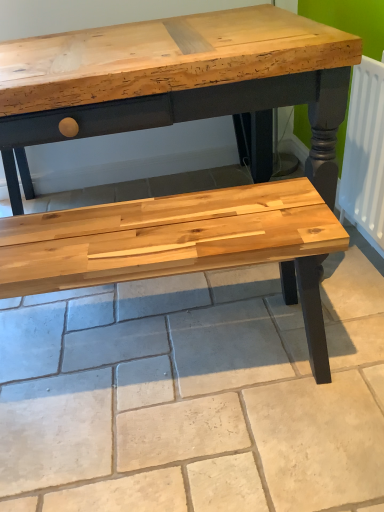
Question: Is natural wood bench at center next to white matte radiator at right and touching it?

Choices:
 (A) no
 (B) yes

Answer: (A)

Question: Is white matte radiator at right surrounded by natural wood bench at center?

Choices:
 (A) no
 (B) yes

Answer: (A)

Question: From a real-world perspective, is natural wood bench at center located higher than white matte radiator at right?

Choices:
 (A) yes
 (B) no

Answer: (B)

Question: Does natural wood bench at center have a smaller size compared to white matte radiator at right?

Choices:
 (A) no
 (B) yes

Answer: (A)

Question: From a real-world perspective, is natural wood bench at center located beneath white matte radiator at right?

Choices:
 (A) no
 (B) yes

Answer: (B)

Question: Does natural wood bench at center turn towards white matte radiator at right?

Choices:
 (A) yes
 (B) no

Answer: (B)

Question: Does white matte radiator at right have a larger size compared to natural wood bench at center?

Choices:
 (A) yes
 (B) no

Answer: (B)

Question: Is white matte radiator at right shorter than natural wood bench at center?

Choices:
 (A) no
 (B) yes

Answer: (A)

Question: From a real-world perspective, is white matte radiator at right beneath natural wood bench at center?

Choices:
 (A) yes
 (B) no

Answer: (B)

Question: Is white matte radiator at right positioned behind natural wood bench at center?

Choices:
 (A) yes
 (B) no

Answer: (A)

Question: Does white matte radiator at right have a lesser width compared to natural wood bench at center?

Choices:
 (A) yes
 (B) no

Answer: (A)

Question: Is white matte radiator at right surrounding natural wood bench at center?

Choices:
 (A) no
 (B) yes

Answer: (A)

Question: In the image, is white matte radiator at right on the left side or the right side of natural wood bench at center?

Choices:
 (A) left
 (B) right

Answer: (B)